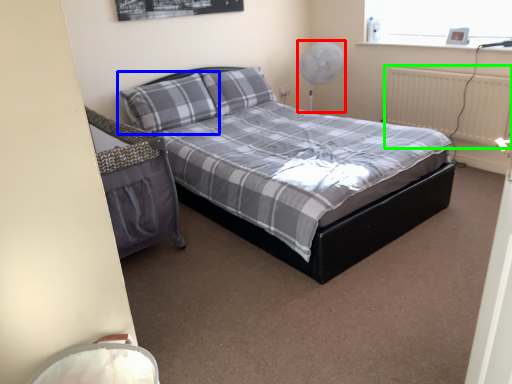
Question: Which object is the closest to the fan (highlighted by a red box)? Choose among these: pillow (highlighted by a blue box) or radiator (highlighted by a green box).

Choices:
 (A) pillow
 (B) radiator

Answer: (B)